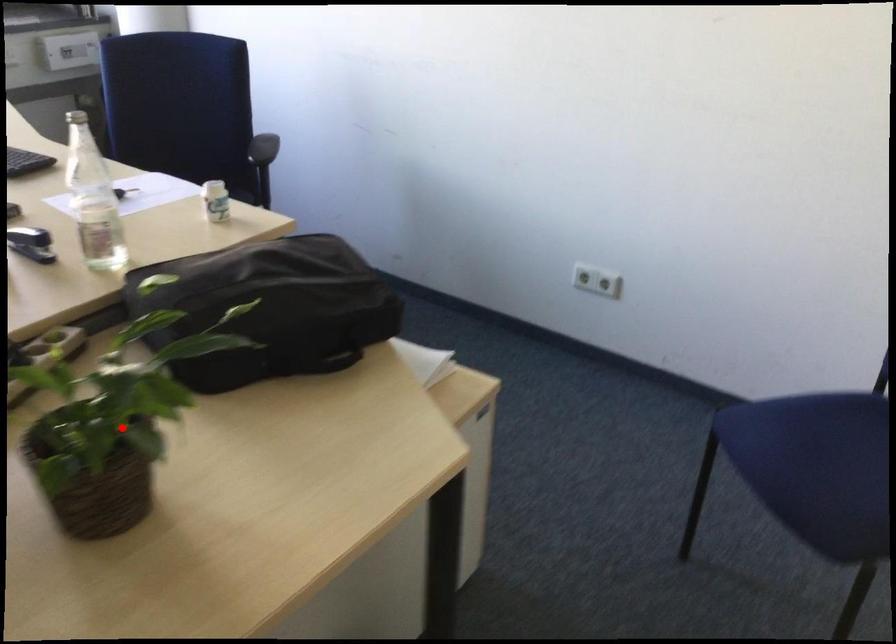
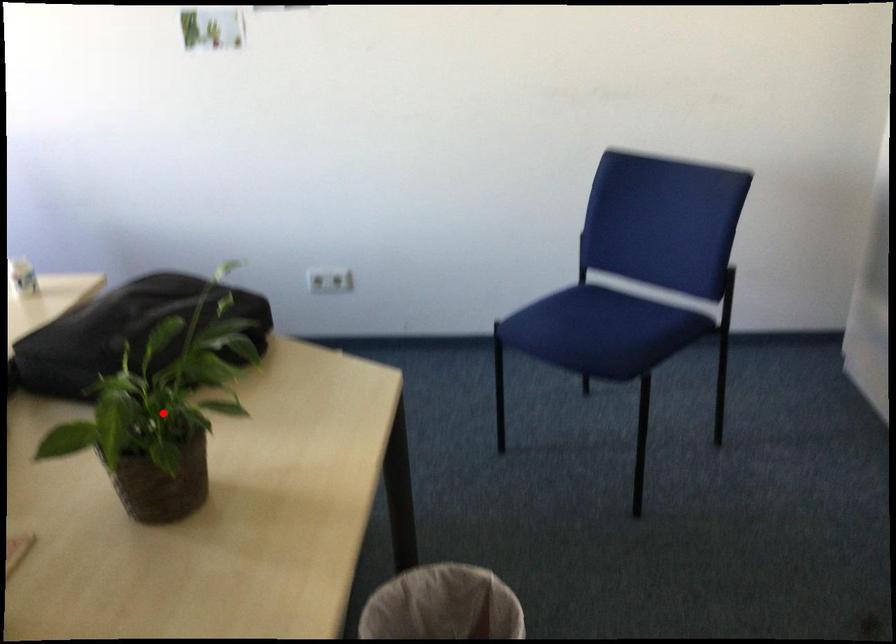
I am providing you with two images of the same scene from different viewpoints. A red point is marked on the first image and another point is marked on the second image. Do the highlighted points in image1 and image2 indicate the same real-world spot?

Yes